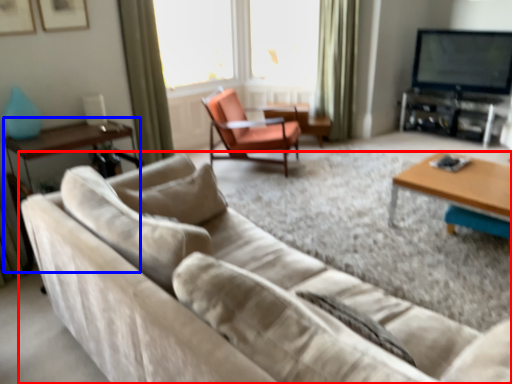
Question: Which object is closer to the camera taking this photo, studio couch (highlighted by a red box) or side table (highlighted by a blue box)?

Choices:
 (A) studio couch
 (B) side table

Answer: (A)